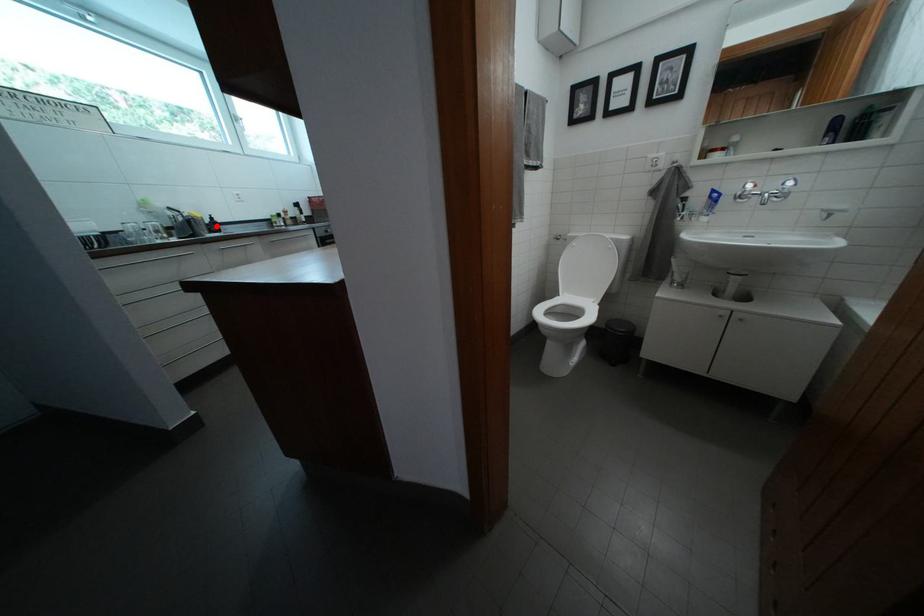
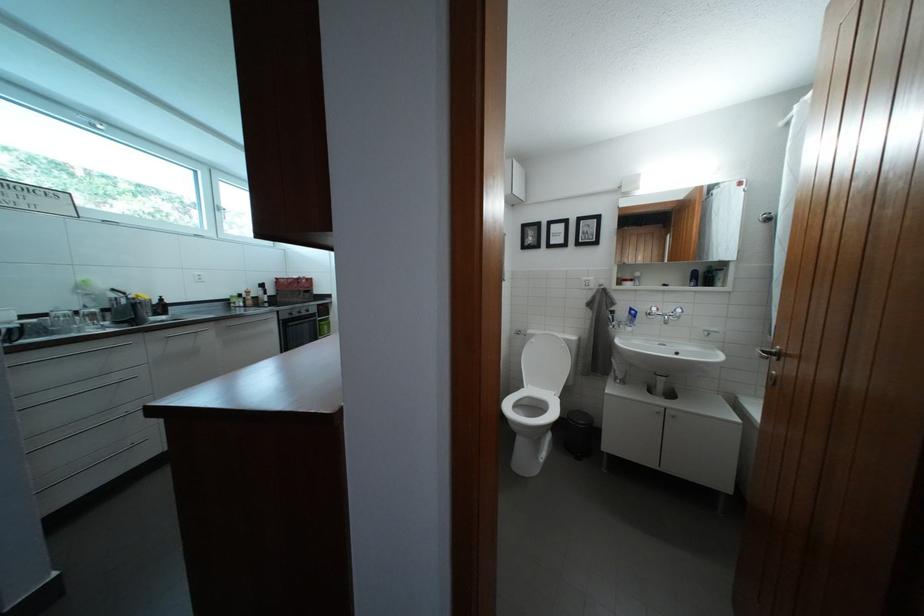
Question: I am providing you with two images of the same scene from different viewpoints. Image1 has a red point marked. In image2, the corresponding 3D location appears at what relative position? Reply with the corresponding letter.

Choices:
 (A) Closer
 (B) Farther

Answer: (B)